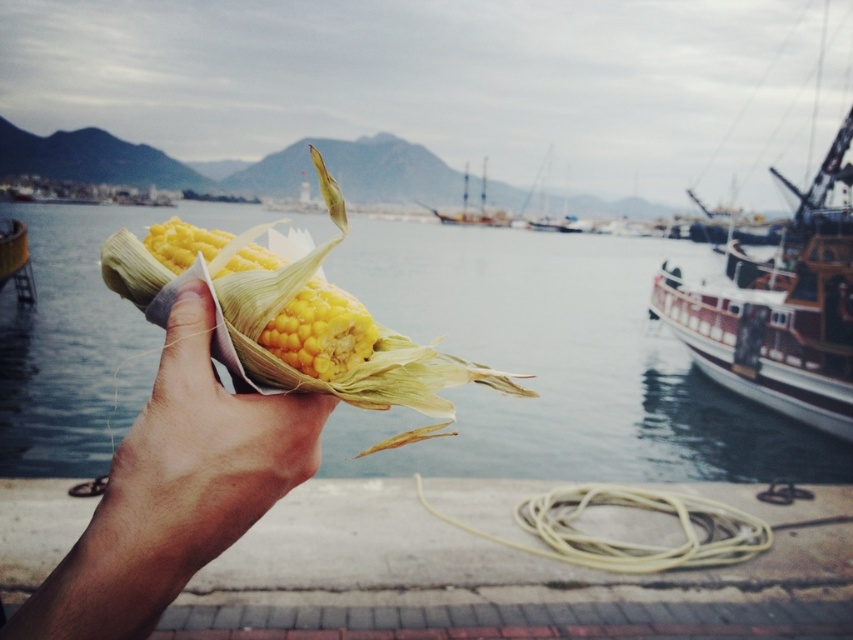
Question: Which object appears farthest from the camera in this image?

Choices:
 (A) yellow matte corn at center
 (B) smooth skin hand at center
 (C) translucent water at corn left

Answer: (C)

Question: Where is translucent water at corn left located in relation to wooden ship at center in the image?

Choices:
 (A) right
 (B) left

Answer: (B)

Question: Which object appears farthest from the camera in this image?

Choices:
 (A) wooden ship at center
 (B) smooth skin hand at center

Answer: (A)

Question: Where is wooden ship at right located in relation to wooden ship at center in the image?

Choices:
 (A) below
 (B) above

Answer: (A)

Question: Does translucent water at corn left appear over wooden ship at center?

Choices:
 (A) yes
 (B) no

Answer: (B)

Question: Which is farther from the wooden ship at right?

Choices:
 (A) yellow matte corn at center
 (B) smooth skin hand at center
 (C) wooden ship at center

Answer: (B)